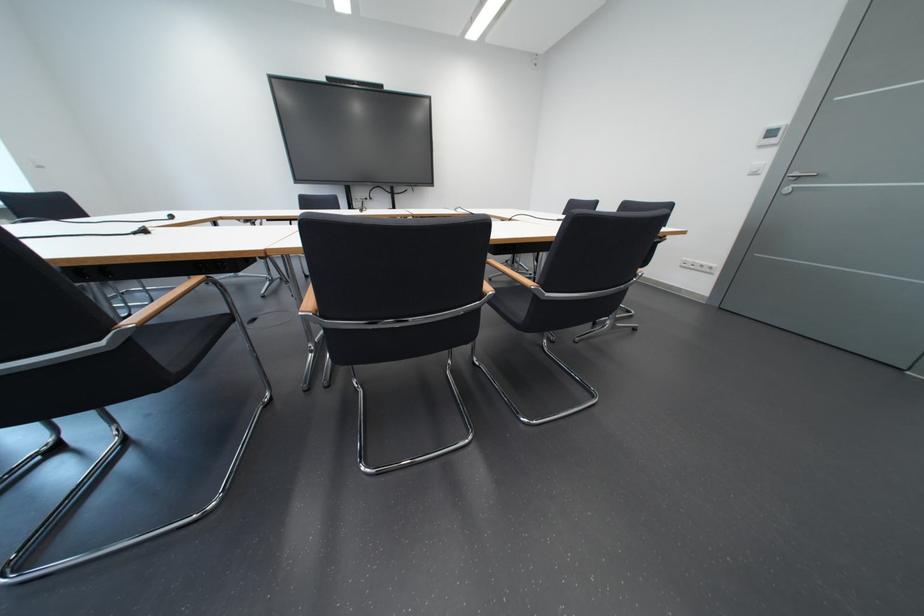
The width and height of the screenshot is (924, 616). Describe the element at coordinates (512, 274) in the screenshot. I see `the black chair sitting surface` at that location.